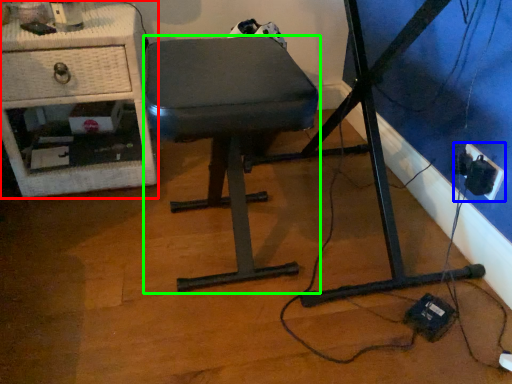
Question: Based on their relative distances, which object is farther from furniture (highlighted by a red box)? Choose from electric outlet (highlighted by a blue box) and stool (highlighted by a green box).

Choices:
 (A) electric outlet
 (B) stool

Answer: (A)